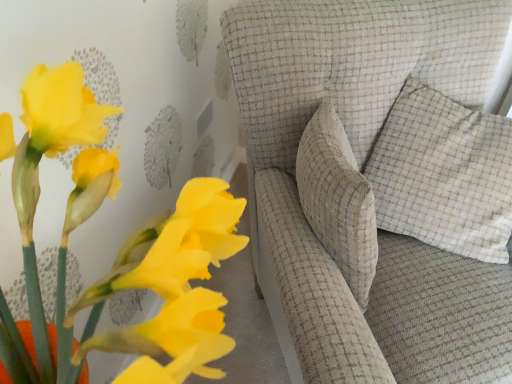
What is the approximate width of beige checkered pillow at upper right?

beige checkered pillow at upper right is 13.14 inches in width.

This screenshot has height=384, width=512. Describe the element at coordinates (444, 174) in the screenshot. I see `beige checkered pillow at upper right` at that location.

Find the location of a particular element. The width and height of the screenshot is (512, 384). matte yellow flowers at lower left is located at coordinates (120, 249).

From the image's perspective, between matte yellow flowers at lower left and beige checkered pillow at upper right, who is located below?

matte yellow flowers at lower left.

Is the depth of matte yellow flowers at lower left less than that of beige checkered pillow at upper right?

Yes, matte yellow flowers at lower left is closer to the viewer.

Is matte yellow flowers at lower left touching beige checkered pillow at upper right?

No, matte yellow flowers at lower left is not beside beige checkered pillow at upper right.

Which object is positioned more to the left, matte yellow flowers at lower left or beige checkered pillow at upper right?

From the viewer's perspective, matte yellow flowers at lower left appears more on the left side.

Which point is more distant from viewer, (99,152) or (323,231)?

Point (323,231)

Which object is further away from the camera, matte yellow flowers at lower left or textured beige sofa at center?

textured beige sofa at center is behind.

From a real-world perspective, is matte yellow flowers at lower left above or below textured beige sofa at center?

matte yellow flowers at lower left is situated higher than textured beige sofa at center in the real world.

Is matte yellow flowers at lower left located outside textured beige sofa at center?

matte yellow flowers at lower left lies outside textured beige sofa at center's area.

Considering the relative sizes of textured beige sofa at center and matte yellow flowers at lower left in the image provided, is textured beige sofa at center thinner than matte yellow flowers at lower left?

In fact, textured beige sofa at center might be wider than matte yellow flowers at lower left.

Is textured beige sofa at center oriented towards matte yellow flowers at lower left?

No, textured beige sofa at center does not turn towards matte yellow flowers at lower left.

In the image, there is a textured beige sofa at center. At what (x,y) coordinates should I click in order to perform the action: click on floral arrangement above it (from the image's perspective). Please return your answer as a coordinate pair (x, y). The image size is (512, 384). Looking at the image, I should click on [120, 249].

Is beige checkered pillow at upper right in front of or behind matte yellow flowers at lower left in the image?

Clearly, beige checkered pillow at upper right is behind matte yellow flowers at lower left.

From the image's perspective, which is below, beige checkered pillow at upper right or matte yellow flowers at lower left?

matte yellow flowers at lower left, from the image's perspective.

Can you confirm if beige checkered pillow at upper right is positioned to the right of matte yellow flowers at lower left?

Yes, beige checkered pillow at upper right is to the right of matte yellow flowers at lower left.

In the image, is beige checkered pillow at upper right positioned in front of or behind textured beige sofa at center?

beige checkered pillow at upper right is behind textured beige sofa at center.

What's the angular difference between beige checkered pillow at upper right and textured beige sofa at center's facing directions?

38.4 degrees separate the facing orientations of beige checkered pillow at upper right and textured beige sofa at center.

Does beige checkered pillow at upper right contain textured beige sofa at center?

That's incorrect, textured beige sofa at center is not inside beige checkered pillow at upper right.

Which of these two, beige checkered pillow at upper right or textured beige sofa at center, is thinner?

With smaller width is beige checkered pillow at upper right.

Measure the distance from textured beige sofa at center to beige checkered pillow at upper right.

They are 3.98 inches apart.

Considering the positions of point (298, 212) and point (405, 128), is point (298, 212) closer or farther from the camera than point (405, 128)?

Point (298, 212).

Is textured beige sofa at center located outside beige checkered pillow at upper right?

Yes, textured beige sofa at center is not within beige checkered pillow at upper right.

From the image's perspective, is textured beige sofa at center above or below beige checkered pillow at upper right?

Based on their image positions, textured beige sofa at center is located beneath beige checkered pillow at upper right.

In order to click on pillow on the right of matte yellow flowers at lower left in this screenshot , I will do `click(444, 174)`.

Where is `floral arrangement above the textured beige sofa at center (from a real-world perspective)`? This screenshot has height=384, width=512. floral arrangement above the textured beige sofa at center (from a real-world perspective) is located at coordinates [120, 249].

When comparing their distances from matte yellow flowers at lower left, does beige checkered pillow at upper right or textured beige sofa at center seem further?

beige checkered pillow at upper right is positioned further to the anchor matte yellow flowers at lower left.

Estimate the real-world distances between objects in this image. Which object is further from textured beige sofa at center, beige checkered pillow at upper right or matte yellow flowers at lower left?

matte yellow flowers at lower left lies further to textured beige sofa at center than the other object.

Based on their spatial positions, is matte yellow flowers at lower left or textured beige sofa at center further from beige checkered pillow at upper right?

Based on the image, matte yellow flowers at lower left appears to be further to beige checkered pillow at upper right.

Looking at the image, which one is located closer to textured beige sofa at center, matte yellow flowers at lower left or beige checkered pillow at upper right?

Among the two, beige checkered pillow at upper right is located nearer to textured beige sofa at center.

Based on their spatial positions, is textured beige sofa at center or beige checkered pillow at upper right further from matte yellow flowers at lower left?

beige checkered pillow at upper right is further to matte yellow flowers at lower left.

Which object lies nearer to the anchor point beige checkered pillow at upper right, textured beige sofa at center or matte yellow flowers at lower left?

textured beige sofa at center is closer to beige checkered pillow at upper right.

The width and height of the screenshot is (512, 384). Find the location of `furniture between matte yellow flowers at lower left and beige checkered pillow at upper right from left to right`. furniture between matte yellow flowers at lower left and beige checkered pillow at upper right from left to right is located at coordinates point(378,185).